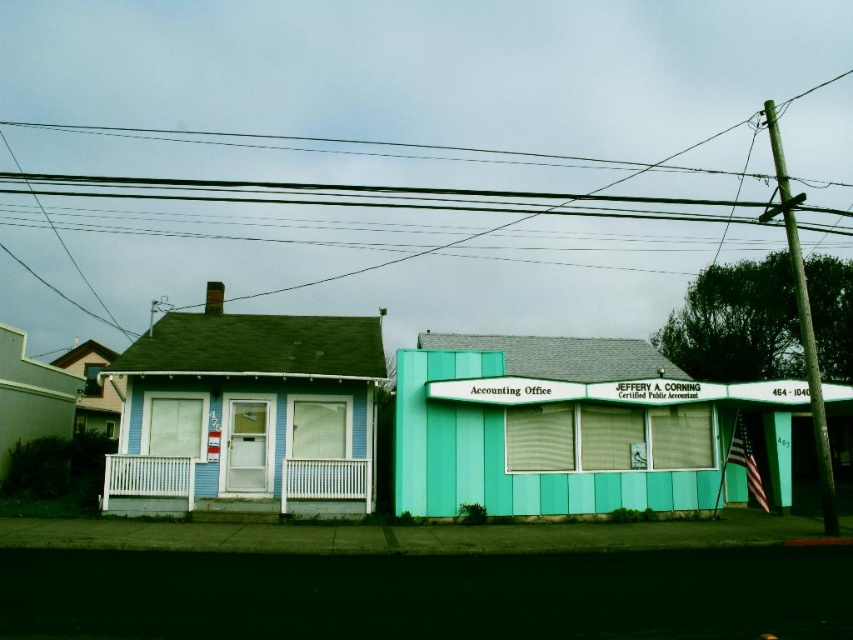
Looking at this image, you are standing on the street in front of the Accounting Office building. You notice two points marked on the buildings. The first point is at coordinate point(399, 499) and the second is at point(260, 198). Which point is closer to you as you face the buildings?

Point(399, 499) is in front of point(260, 198), so it is closer to you as you face the buildings.

You are standing on the sidewalk in front of the Accounting Office building. You want to locate the teal paneling at center. Where should you look relative to the building?

The teal paneling at center is located at the central area of the building, specifically at coordinates approximately 0.675 on the x and 0.665 on the y axis, so you should look towards the middle section of the building, slightly to the right and lower middle area.

You are a delivery driver who needs to park your vehicle, which is 5 meters long, between the teal paneling at center and the black wire at upper center. Can you fit your vehicle in this space?

The distance between the teal paneling at center and the black wire at upper center is 23.94 meters, which is more than enough to park a 5 meter long vehicle between them.